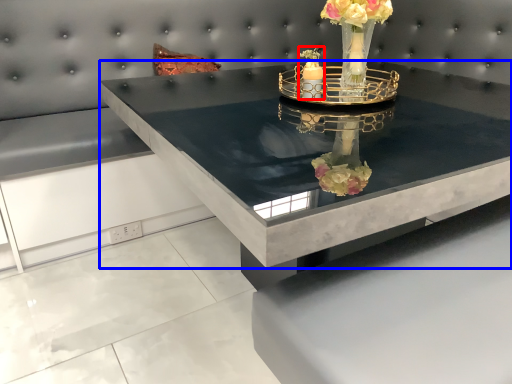
Question: Which of the following is the farthest to the observer, candle holder (highlighted by a red box) or table (highlighted by a blue box)?

Choices:
 (A) candle holder
 (B) table

Answer: (A)